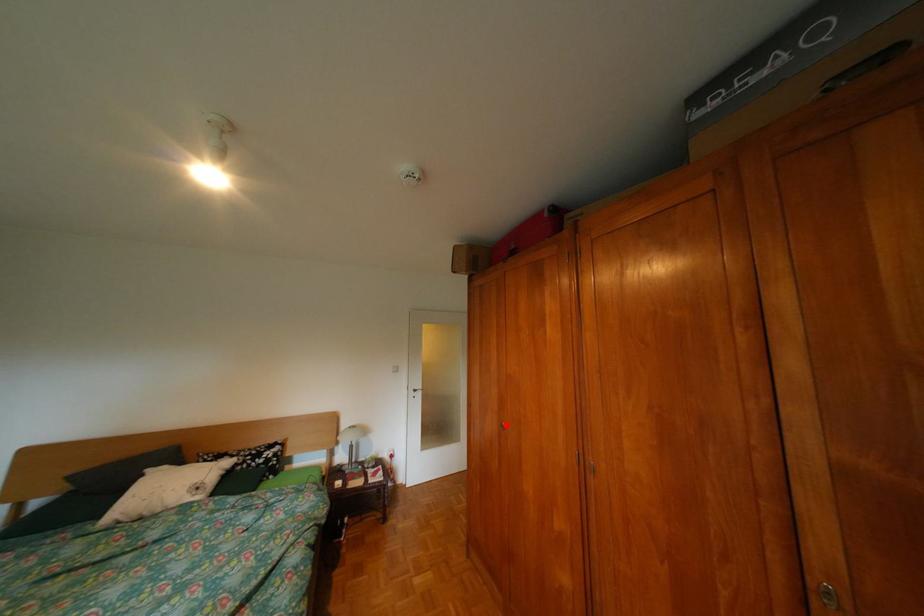
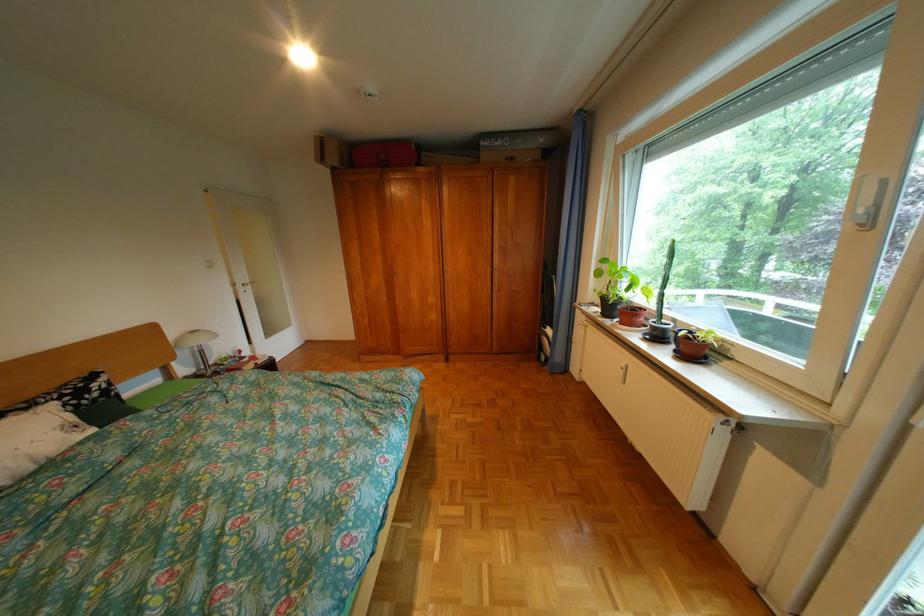
Question: A red point is marked in image1. In image2, is the corresponding 3D point closer to the camera or farther? Reply with the corresponding letter.

Choices:
 (A) The corresponding 3D point is closer.
 (B) The corresponding 3D point is farther.

Answer: (A)